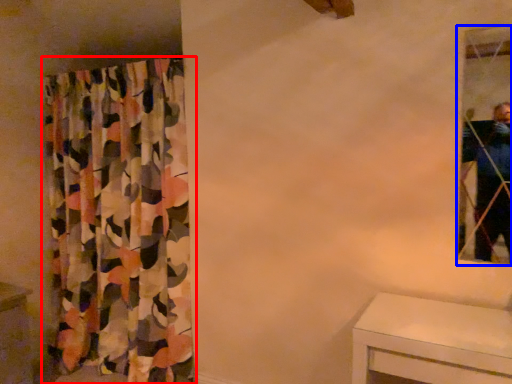
Question: Which of the following is the closest to the observer, curtain (highlighted by a red box) or mirror (highlighted by a blue box)?

Choices:
 (A) curtain
 (B) mirror

Answer: (B)